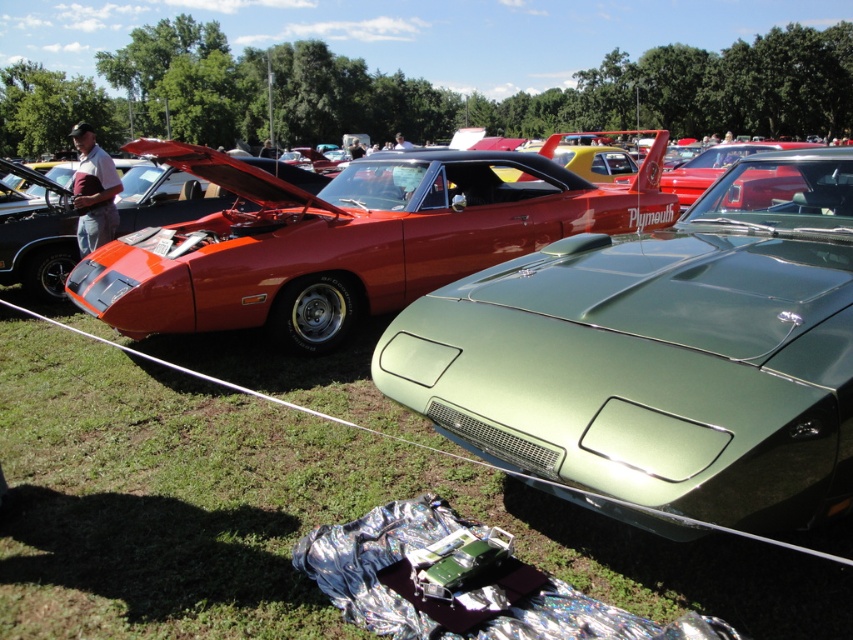
Based on the coordinates provided, where exactly is the satin green car at center located in the image?

The satin green car at center is located at point coordinates of 0.559 on the x axis and 0.775 on the y axis.

You are a photographer at the car show and want to capture both the satin green car at center and the silver reflective foil at lower center in a single shot. Which object should you focus on first to ensure both are in frame?

The satin green car at center is located above the silver reflective foil at lower center, so you should focus on the silver reflective foil at lower center first to ensure both are in frame.

You are a photographer setting up equipment for the car show. You have a silver reflective foil at lower center that you want to use as a backdrop for the satin green car at center. Given their sizes, will the foil be large enough to cover the entire car?

The satin green car at center is larger in size than the silver reflective foil at lower center, so the foil will not be large enough to cover the entire car.